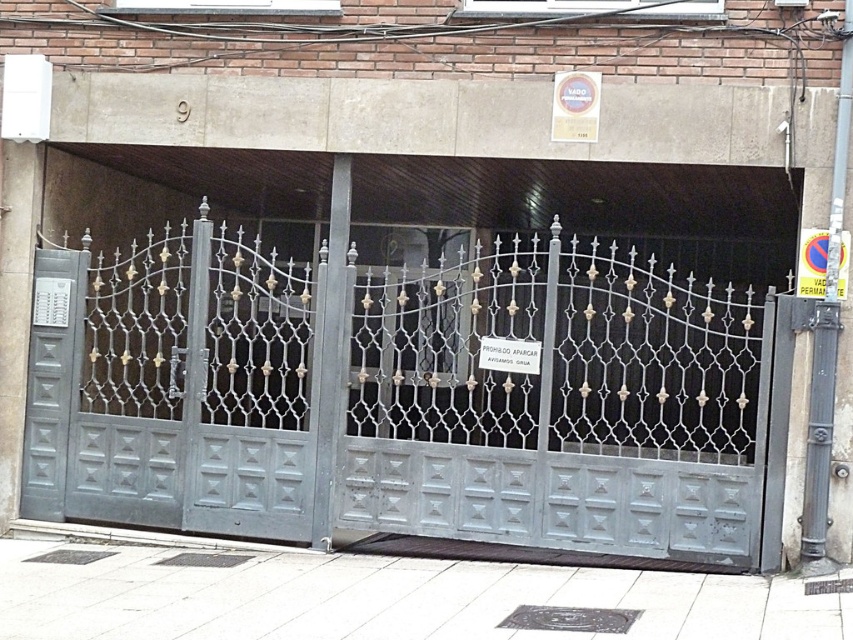
You are standing in front of the metallic gate at center and want to enter the building through the matte gray door at left. Can you walk directly to the door without going through the gate?

The metallic gate at center is closer to the viewer than the matte gray door at left, so you must pass through the metallic gate at center first before reaching the matte gray door at left.

You are standing in front of the building and want to take a photo of the metallic gate at center. If you are currently 29.22 feet away from it, is that the closest you can get to capture the entire gate in your shot?

The distance between you and the metallic gate at center is exactly 29.22 feet, which is the closest you can get to capture the entire gate in your shot without moving the gate itself.

You are a delivery person trying to enter through the entrance. You see a metallic gate at center and a matte gray door at left. Which one is higher up?

The metallic gate at center is above the matte gray door at left, so the metallic gate at center is higher up.